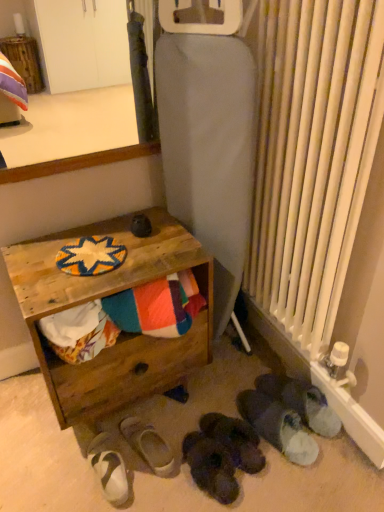
Question: From a real-world perspective, is black suede slippers at lower center, acting as the 4th footwear starting from the left, over wooden surface at upper left?

Choices:
 (A) no
 (B) yes

Answer: (A)

Question: Can you confirm if black suede slippers at lower center, acting as the 4th footwear starting from the left, is shorter than wooden surface at upper left?

Choices:
 (A) yes
 (B) no

Answer: (A)

Question: Does black suede slippers at lower center, positioned as the 3th footwear in right-to-left order, turn towards wooden surface at upper left?

Choices:
 (A) no
 (B) yes

Answer: (A)

Question: Can you confirm if black suede slippers at lower center, acting as the 4th footwear starting from the left, is positioned to the right of wooden surface at upper left?

Choices:
 (A) yes
 (B) no

Answer: (A)

Question: Can we say black suede slippers at lower center, positioned as the 3th footwear in right-to-left order, lies outside wooden surface at upper left?

Choices:
 (A) yes
 (B) no

Answer: (A)

Question: From a real-world perspective, is white fabric slipper at lower center, the 2th footwear in the left-to-right sequence, positioned above or below black suede slippers at lower center, positioned as the 3th footwear in right-to-left order?

Choices:
 (A) above
 (B) below

Answer: (B)

Question: In the image, is white fabric slipper at lower center, which appears as the fifth footwear when viewed from the right, positioned in front of or behind black suede slippers at lower center, positioned as the 3th footwear in right-to-left order?

Choices:
 (A) behind
 (B) front

Answer: (A)

Question: In terms of height, does white fabric slipper at lower center, the 2th footwear in the left-to-right sequence, look taller or shorter compared to black suede slippers at lower center, acting as the 4th footwear starting from the left?

Choices:
 (A) tall
 (B) short

Answer: (B)

Question: Considering the positions of white fabric slipper at lower center, the 2th footwear in the left-to-right sequence, and black suede slippers at lower center, acting as the 4th footwear starting from the left, in the image, is white fabric slipper at lower center, the 2th footwear in the left-to-right sequence, bigger or smaller than black suede slippers at lower center, acting as the 4th footwear starting from the left,?

Choices:
 (A) small
 (B) big

Answer: (A)

Question: From the image's perspective, relative to white fabric slipper at lower center, which appears as the fifth footwear when viewed from the right, is white fuzzy slippers at lower right, placed as the 5th footwear when sorted from left to right, above or below?

Choices:
 (A) above
 (B) below

Answer: (A)

Question: From a real-world perspective, relative to white fabric slipper at lower center, which appears as the fifth footwear when viewed from the right, is white fuzzy slippers at lower right, which is the second footwear from right to left, vertically above or below?

Choices:
 (A) below
 (B) above

Answer: (B)

Question: Considering the positions of white fuzzy slippers at lower right, which is the second footwear from right to left, and white fabric slipper at lower center, which appears as the fifth footwear when viewed from the right, in the image, is white fuzzy slippers at lower right, which is the second footwear from right to left, taller or shorter than white fabric slipper at lower center, which appears as the fifth footwear when viewed from the right,?

Choices:
 (A) tall
 (B) short

Answer: (A)

Question: Considering the positions of white fuzzy slippers at lower right, placed as the 5th footwear when sorted from left to right, and white fabric slipper at lower center, which appears as the fifth footwear when viewed from the right, in the image, is white fuzzy slippers at lower right, placed as the 5th footwear when sorted from left to right, bigger or smaller than white fabric slipper at lower center, which appears as the fifth footwear when viewed from the right,?

Choices:
 (A) small
 (B) big

Answer: (B)

Question: Considering their positions, is wooden surface at upper left located in front of or behind white suede sandals at lower left, which ranks as the 1th footwear in left-to-right order?

Choices:
 (A) behind
 (B) front

Answer: (B)

Question: Would you say wooden surface at upper left is inside or outside white suede sandals at lower left, which appears as the 6th footwear when viewed from the right?

Choices:
 (A) inside
 (B) outside

Answer: (B)